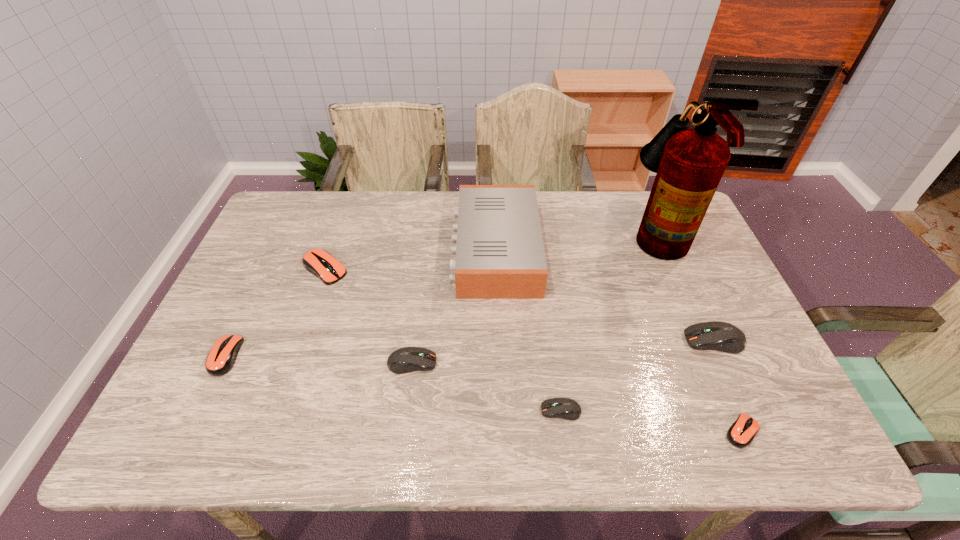
Locate an element on the screen. This screenshot has height=540, width=960. vacant space positioned 0.100m on the back of the shortest object is located at coordinates (718, 375).

Identify the location of fire extinguisher that is at the far edge. (689, 163).

Where is `radio receiver that is at the far edge`? This screenshot has width=960, height=540. radio receiver that is at the far edge is located at coordinates (500, 254).

In order to click on object present at the left edge in this screenshot , I will do `click(221, 358)`.

Where is `fire extinguisher located at the right edge`? fire extinguisher located at the right edge is located at coordinates (689, 163).

You are a GUI agent. You are given a task and a screenshot of the screen. Output one action in this format:
    pyautogui.click(x=<x>, y=<y>)
    Task: Click on the object that is at the far right corner
    The width and height of the screenshot is (960, 540).
    Given the screenshot: What is the action you would take?
    pyautogui.click(x=689, y=163)

Image resolution: width=960 pixels, height=540 pixels. Find the location of `object that is positioned at the near right corner`. object that is positioned at the near right corner is located at coordinates (741, 433).

Image resolution: width=960 pixels, height=540 pixels. In the image, there is a desktop. What are the coordinates of `free space at the far edge` in the screenshot? It's located at (596, 220).

At what (x,y) coordinates should I click in order to perform the action: click on free space at the near edge. Please return your answer as a coordinate pair (x, y). The height and width of the screenshot is (540, 960). Looking at the image, I should click on (565, 439).

Identify the location of vacant space at the left edge. (219, 386).